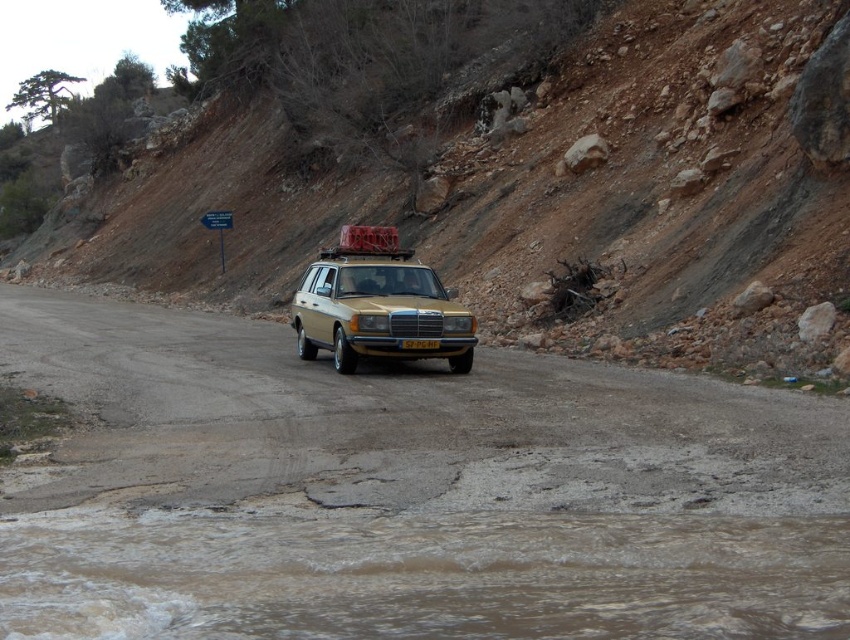
Looking at this image, between dull brown dirt at center and yellow plastic license plate at center, which one has more height?

dull brown dirt at center is taller.

Is point (622, 97) positioned in front of point (418, 346)?

No.

Find the location of `dull brown dirt at center`. dull brown dirt at center is located at coordinates (658, 198).

Is dull brown dirt at center bigger than gold metallic car at center?

Correct, dull brown dirt at center is larger in size than gold metallic car at center.

Does dull brown dirt at center have a smaller size compared to gold metallic car at center?

No, dull brown dirt at center is not smaller than gold metallic car at center.

Is point (824, 26) positioned in front of point (332, 300)?

No, it is behind (332, 300).

Identify the location of dull brown dirt at center. (658, 198).

Between gold metallic car at center and yellow plastic license plate at center, which one is positioned higher?

yellow plastic license plate at center

Does gold metallic car at center appear under yellow plastic license plate at center?

Yes.

Is point (409, 278) farther from viewer compared to point (429, 340)?

Yes, point (409, 278) is behind point (429, 340).

I want to click on gold metallic car at center, so click(x=377, y=305).